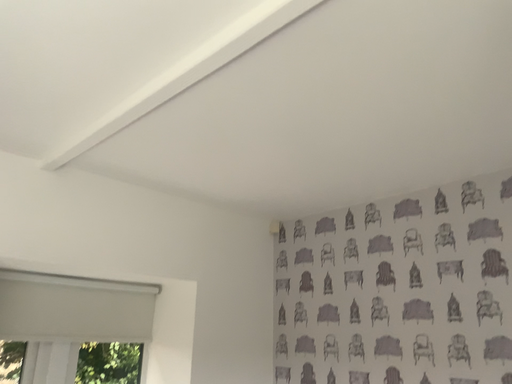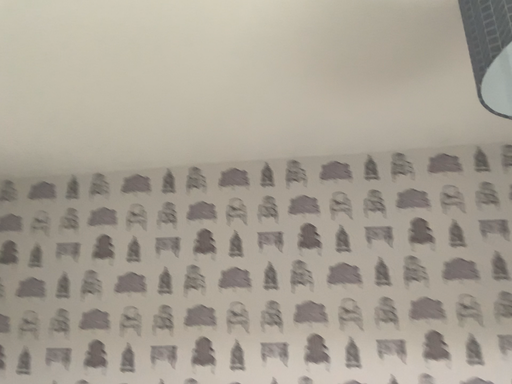
Question: How did the camera likely rotate when shooting the video?

Choices:
 (A) rotated downward
 (B) rotated upward

Answer: (A)